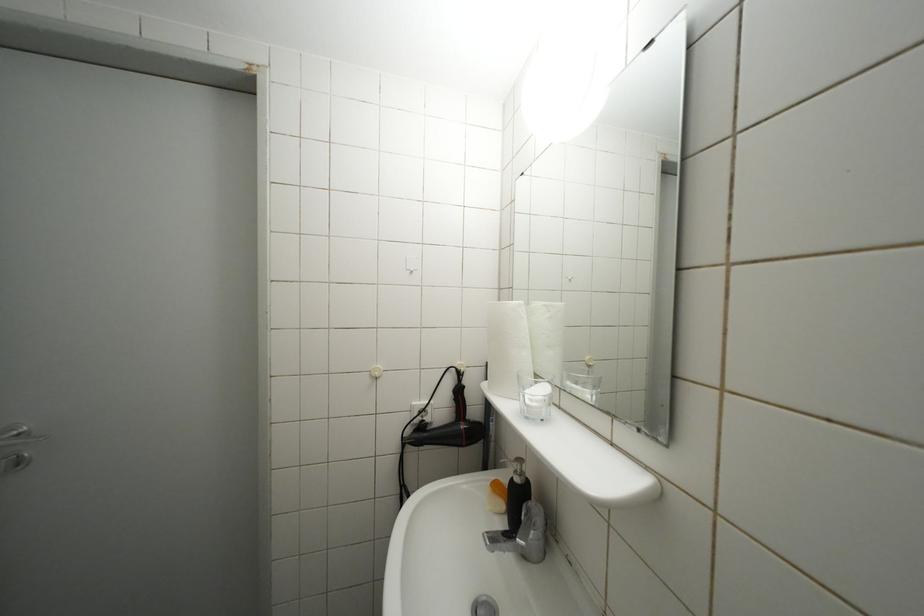
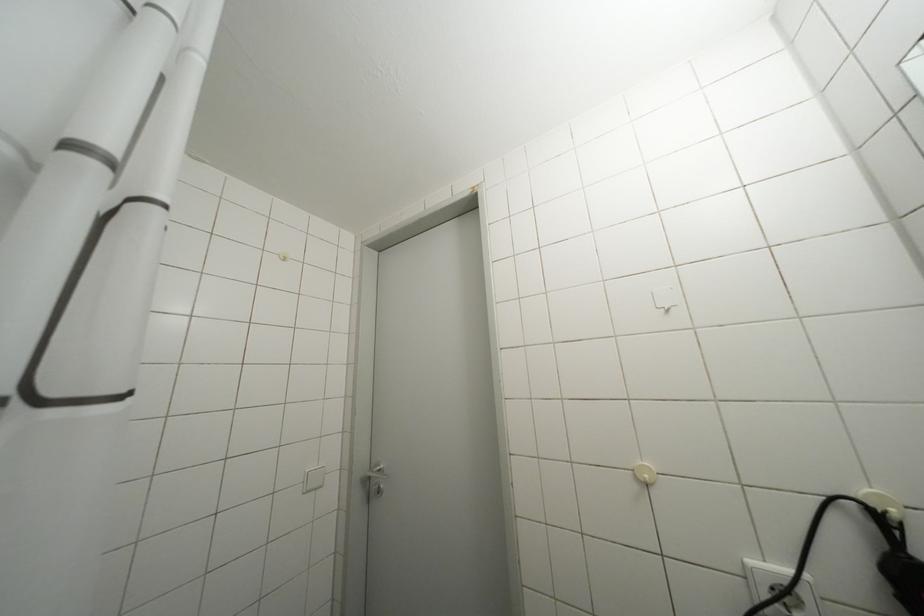
The first image is from the beginning of the video and the second image is from the end. How did the camera likely rotate when shooting the video?

The camera rotated toward left-up.